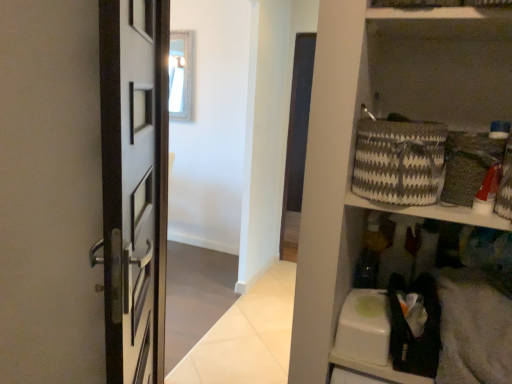
Locate an element on the screen. wooden frame mirror at upper center is located at coordinates click(x=181, y=76).

Where is `wooden frame mirror at upper center`? wooden frame mirror at upper center is located at coordinates (181, 76).

Is wooden frame mirror at upper center shorter than gray and white woven basket at upper right?

No.

Is there a large distance between wooden frame mirror at upper center and gray and white woven basket at upper right?

That's right, there is a large distance between wooden frame mirror at upper center and gray and white woven basket at upper right.

Based on the photo, how far apart are wooden frame mirror at upper center and gray and white woven basket at upper right?

They are 10.56 feet apart.

Based on their positions, is wooden frame mirror at upper center located to the left or right of gray and white woven basket at upper right?

In the image, wooden frame mirror at upper center appears on the left side of gray and white woven basket at upper right.

Is gray and white woven basket at upper right not near wooden frame mirror at upper center?

Yes, gray and white woven basket at upper right and wooden frame mirror at upper center are quite far apart.

Would you say wooden frame mirror at upper center is part of gray and white woven basket at upper right's contents?

No.

Considering the sizes of objects gray and white woven basket at upper right and wooden frame mirror at upper center in the image provided, who is wider, gray and white woven basket at upper right or wooden frame mirror at upper center?

With larger width is gray and white woven basket at upper right.

Looking at this image, does white glossy wall at upper center have a lesser width compared to wooden frame mirror at upper center?

In fact, white glossy wall at upper center might be wider than wooden frame mirror at upper center.

Which object is further away from the camera, white glossy wall at upper center or wooden frame mirror at upper center?

wooden frame mirror at upper center is further from the camera.

From the picture: Considering the relative positions of white glossy wall at upper center and wooden frame mirror at upper center in the image provided, is white glossy wall at upper center to the left of wooden frame mirror at upper center from the viewer's perspective?

No, white glossy wall at upper center is not to the left of wooden frame mirror at upper center.

Is point (204, 217) closer or farther from the camera than point (437, 200)?

Point (204, 217).

Is white glossy wall at upper center at the left side of gray and white woven basket at upper right?

Yes.

From the picture: Are white glossy wall at upper center and gray and white woven basket at upper right making contact?

No, white glossy wall at upper center is not touching gray and white woven basket at upper right.

Is gray and white woven basket at upper right not near white glossy wall at upper center?

gray and white woven basket at upper right is positioned a significant distance from white glossy wall at upper center.

Between gray and white woven basket at upper right and white glossy wall at upper center, which one has smaller width?

With smaller width is white glossy wall at upper center.

From a real-world perspective, between gray and white woven basket at upper right and white glossy wall at upper center, who is vertically higher?

From a 3D spatial view, gray and white woven basket at upper right is above.

Does gray and white woven basket at upper right appear on the right side of white glossy wall at upper center?

Yes, gray and white woven basket at upper right is to the right of white glossy wall at upper center.

Consider the image. From a real-world perspective, who is located lower, wooden frame mirror at upper center or white glossy wall at upper center?

white glossy wall at upper center is physically lower.

From the image's perspective, is wooden frame mirror at upper center on top of white glossy wall at upper center?

Correct, wooden frame mirror at upper center appears higher than white glossy wall at upper center in the image.

Which object is closer to the camera, wooden frame mirror at upper center or white glossy wall at upper center?

white glossy wall at upper center is in front.

Consider the image. Can you confirm if wooden frame mirror at upper center is positioned to the left of white glossy wall at upper center?

Yes.

The height and width of the screenshot is (384, 512). I want to click on window above the gray and white woven basket at upper right (from the image's perspective), so click(181, 76).

Where is `window that is behind the gray and white woven basket at upper right`? This screenshot has width=512, height=384. window that is behind the gray and white woven basket at upper right is located at coordinates (181, 76).

Consider the image. Looking at the image, which one is located closer to wooden frame mirror at upper center, white glossy wall at upper center or gray and white woven basket at upper right?

Among the two, white glossy wall at upper center is located nearer to wooden frame mirror at upper center.

Which object lies nearer to the anchor point wooden frame mirror at upper center, gray and white woven basket at upper right or white glossy wall at upper center?

The object closer to wooden frame mirror at upper center is white glossy wall at upper center.

Considering their positions, is gray and white woven basket at upper right positioned further to white glossy wall at upper center than wooden frame mirror at upper center?

gray and white woven basket at upper right is further to white glossy wall at upper center.

Considering their positions, is wooden frame mirror at upper center positioned closer to gray and white woven basket at upper right than white glossy wall at upper center?

white glossy wall at upper center is closer to gray and white woven basket at upper right.

When comparing their distances from white glossy wall at upper center, does wooden frame mirror at upper center or gray and white woven basket at upper right seem further?

gray and white woven basket at upper right.

Based on their spatial positions, is white glossy wall at upper center or wooden frame mirror at upper center further from gray and white woven basket at upper right?

wooden frame mirror at upper center is positioned further to the anchor gray and white woven basket at upper right.

Locate an element on the screen. The width and height of the screenshot is (512, 384). corridor between gray and white woven basket at upper right and wooden frame mirror at upper center in the front-back direction is located at coordinates (236, 127).